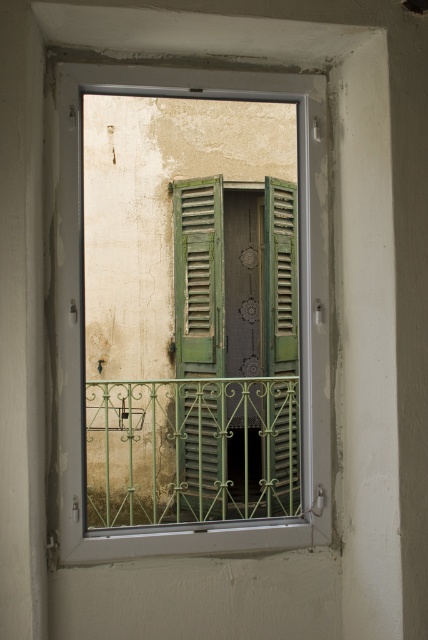
Question: Which object is closer to the camera taking this photo?

Choices:
 (A) green matte shutters at center
 (B) green wooden shutters at center

Answer: (B)

Question: Observing the image, what is the correct spatial positioning of green matte shutters at center in reference to green wooden shutters at center?

Choices:
 (A) right
 (B) left

Answer: (B)

Question: Estimate the real-world distances between objects in this image. Which object is closer to the green wooden shutters at center?

Choices:
 (A) green wrought iron balcony at center
 (B) green matte shutters at center

Answer: (A)

Question: Considering the relative positions of green matte shutters at center and green wooden shutters at center in the image provided, where is green matte shutters at center located with respect to green wooden shutters at center?

Choices:
 (A) below
 (B) above

Answer: (B)

Question: Which point appears closest to the camera in this image?

Choices:
 (A) (71, 552)
 (B) (193, 384)

Answer: (A)

Question: Is green wooden shutters at center bigger than green wrought iron balcony at center?

Choices:
 (A) no
 (B) yes

Answer: (B)